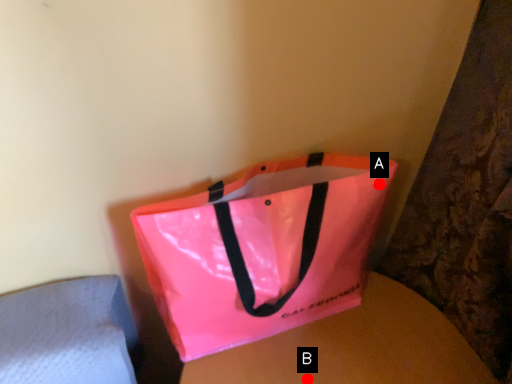
Question: Two points are circled on the image, labeled by A and B beside each circle. Which point is farther from the camera taking this photo?

Choices:
 (A) A is further
 (B) B is further

Answer: (B)